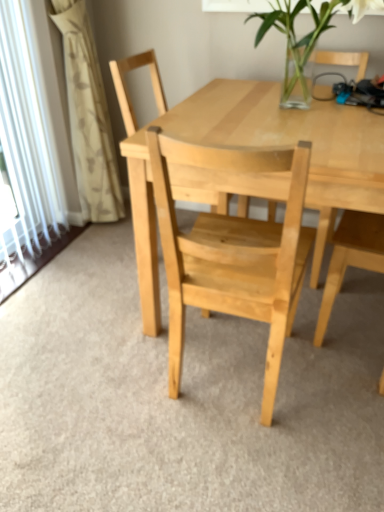
Find the location of a particular element. vacant region to the left of natural wood table at center is located at coordinates (79, 326).